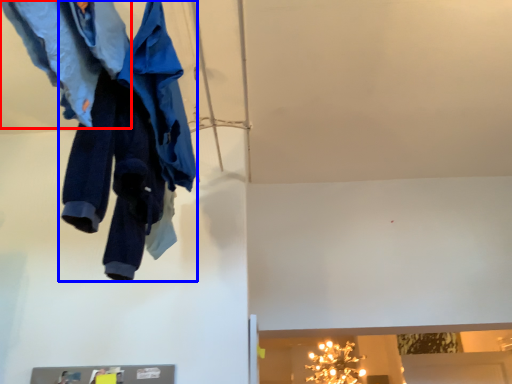
Question: Which object appears closest to the camera in this image, trousers (highlighted by a red box) or trousers (highlighted by a blue box)?

Choices:
 (A) trousers
 (B) trousers

Answer: (A)